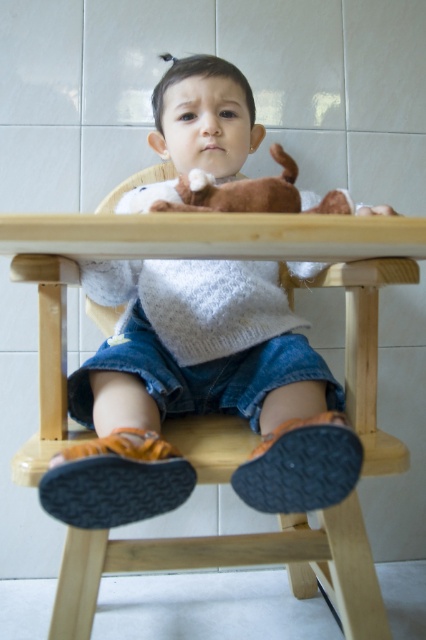
This screenshot has width=426, height=640. Describe the element at coordinates (198, 394) in the screenshot. I see `white knitted sweater at center` at that location.

Is white knitted sweater at center further to camera compared to wooden table at center?

Yes, it is behind wooden table at center.

Is point (196, 140) positioned after point (232, 433)?

Yes, it is behind point (232, 433).

Where is `white knitted sweater at center`? The height and width of the screenshot is (640, 426). white knitted sweater at center is located at coordinates (198, 394).